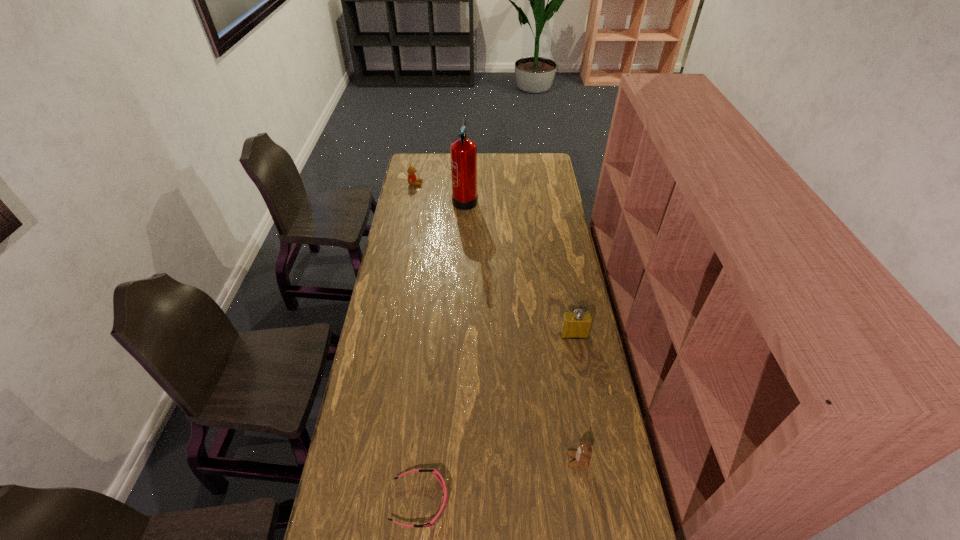
Locate an element on the screen. This screenshot has width=960, height=540. free location at the far left corner of the desktop is located at coordinates (431, 161).

Where is `free space between the goggles and the fire extinguisher`? The image size is (960, 540). free space between the goggles and the fire extinguisher is located at coordinates (443, 350).

At what (x,y) coordinates should I click in order to perform the action: click on free area in between the goggles and the shorter teddy bear. Please return your answer as a coordinate pair (x, y). The width and height of the screenshot is (960, 540). Looking at the image, I should click on (499, 481).

At what (x,y) coordinates should I click in order to perform the action: click on free spot between the taller teddy bear and the fourth tallest object. Please return your answer as a coordinate pair (x, y). The height and width of the screenshot is (540, 960). Looking at the image, I should click on (496, 322).

This screenshot has width=960, height=540. I want to click on vacant space that is in between the fire extinguisher and the shorter teddy bear, so click(x=521, y=329).

Where is `unoccupied position between the second shortest object and the shortest object`? The width and height of the screenshot is (960, 540). unoccupied position between the second shortest object and the shortest object is located at coordinates (499, 481).

Identify the location of empty location between the tallest object and the second tallest object. The image size is (960, 540). (519, 267).

Where is `vacant space that's between the fire extinguisher and the goggles`? This screenshot has width=960, height=540. vacant space that's between the fire extinguisher and the goggles is located at coordinates (443, 350).

Find the location of `free area in between the goggles and the second tallest object`. free area in between the goggles and the second tallest object is located at coordinates (497, 418).

This screenshot has width=960, height=540. I want to click on free space between the left teddy bear and the shortest object, so click(418, 342).